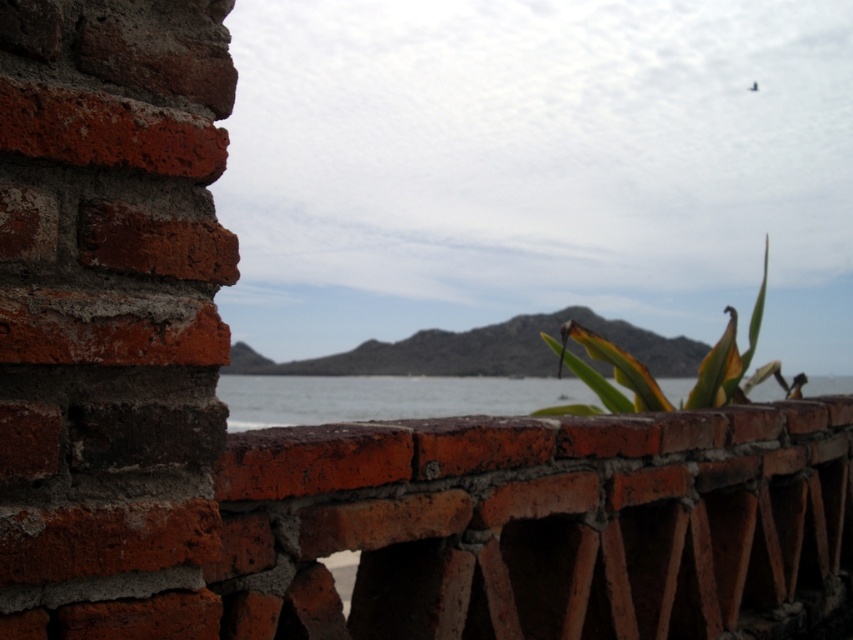
Is point (265, 385) positioned after point (566, 413)?

Yes, point (265, 385) is farther from viewer.

Looking at this image, is clear water at center positioned in front of green leafy plant at center?

Yes, clear water at center is closer to the viewer.

Is point (509, 385) closer to camera compared to point (747, 333)?

No, it is behind (747, 333).

Identify the location of clear water at center. This screenshot has width=853, height=640. (386, 397).